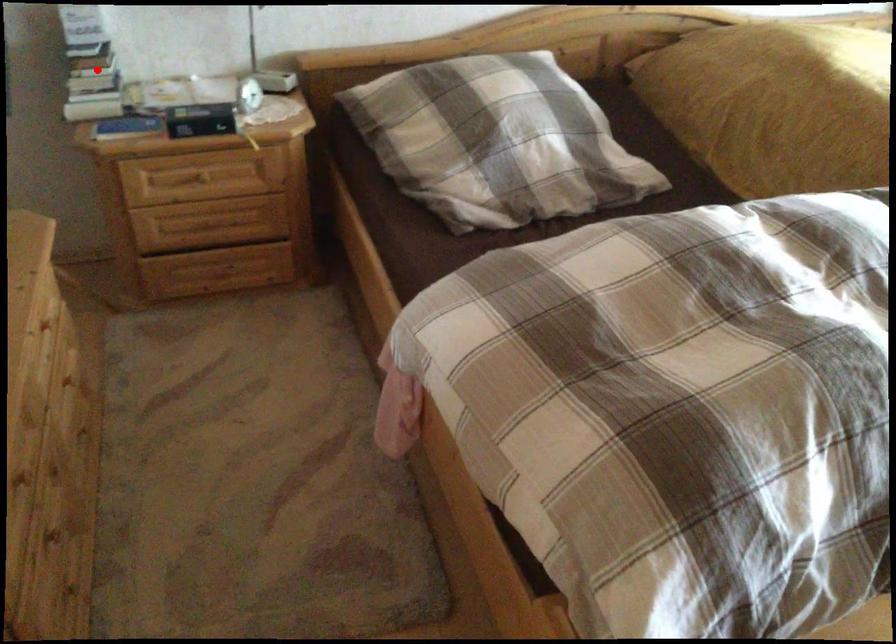
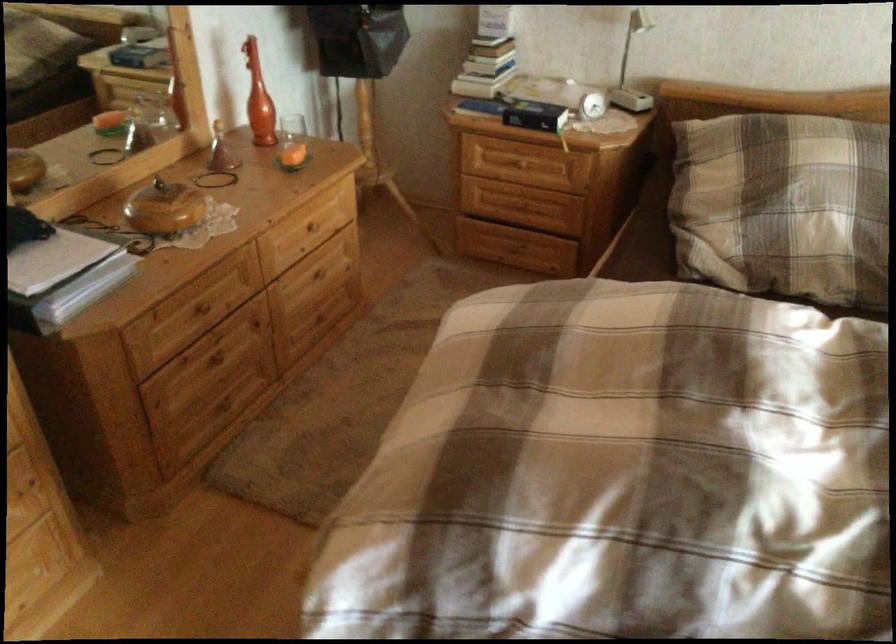
Find the pixel in the second image that matches the highlighted location in the first image.

(487, 49)